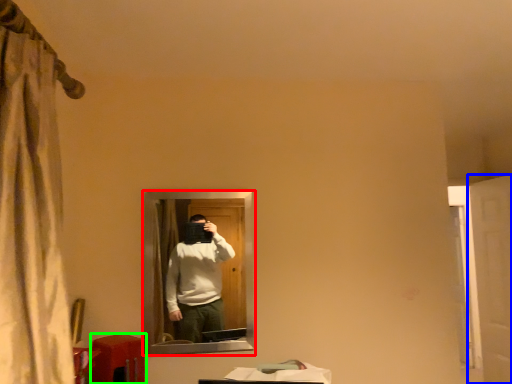
Question: Which object is positioned farthest from mirror (highlighted by a red box)? Select from screen door (highlighted by a blue box) and table (highlighted by a green box).

Choices:
 (A) screen door
 (B) table

Answer: (A)